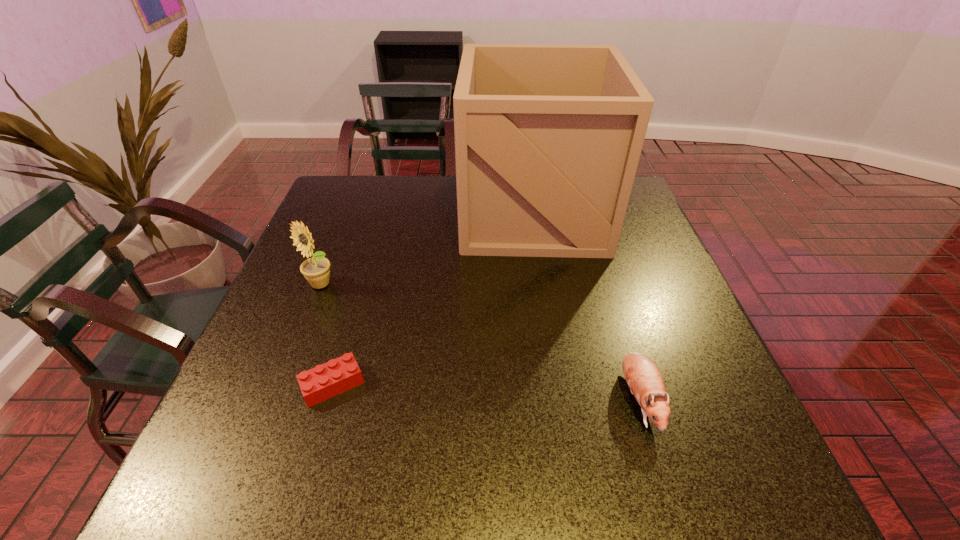
I want to click on free space between the shortest object and the hamster, so click(486, 392).

Find the location of a particular element. The image size is (960, 540). empty space that is in between the box and the second farthest object is located at coordinates (426, 249).

Image resolution: width=960 pixels, height=540 pixels. I want to click on empty space that is in between the third tallest object and the box, so click(x=586, y=306).

Where is `free space between the Lego and the third tallest object`? This screenshot has width=960, height=540. free space between the Lego and the third tallest object is located at coordinates (486, 392).

Locate an element on the screen. The width and height of the screenshot is (960, 540). vacant area that lies between the shortest object and the tallest object is located at coordinates (433, 299).

The image size is (960, 540). I want to click on blank region between the box and the third tallest object, so click(586, 306).

This screenshot has width=960, height=540. What are the coordinates of `blank region between the tallest object and the third shortest object` in the screenshot? It's located at (426, 249).

This screenshot has height=540, width=960. I want to click on unoccupied area between the tallest object and the sunflower, so click(426, 249).

The image size is (960, 540). In order to click on vacant space that's between the tallest object and the sunflower in this screenshot , I will do `click(426, 249)`.

The width and height of the screenshot is (960, 540). I want to click on unoccupied position between the third tallest object and the tallest object, so click(x=586, y=306).